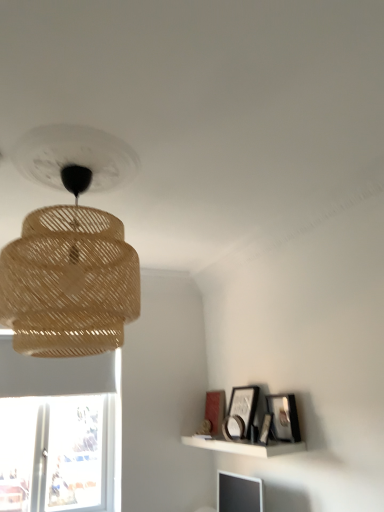
Question: In terms of width, does white matte shelf at lower right look wider or thinner when compared to natural woven lampshade at upper left?

Choices:
 (A) wide
 (B) thin

Answer: (B)

Question: Does point (279, 451) appear closer or farther from the camera than point (92, 263)?

Choices:
 (A) closer
 (B) farther

Answer: (B)

Question: Which is farther from the matte black picture frame at upper right, acting as the fifth picture frame starting from the front?

Choices:
 (A) natural woven lampshade at upper left
 (B) white matte shelf at lower right
 (C) matte black picture frame at upper right, the fourth picture frame from the back
 (D) matte black picture frame at upper right, the 2th picture frame from the back
 (E) wooden picture frame at upper right, placed as the 3th picture frame when sorted from front to back

Answer: (A)

Question: Which of these objects is positioned farthest from the matte black picture frame at upper right, acting as the fifth picture frame starting from the front?

Choices:
 (A) matte black picture frame at upper right, which is the second picture frame in front-to-back order
 (B) matte black monitor at lower right
 (C) matte black picture frame at upper right, the 2th picture frame from the back
 (D) white matte shelf at lower right
 (E) matte black picture frame at lower right, arranged as the 1th picture frame when viewed from the front

Answer: (E)